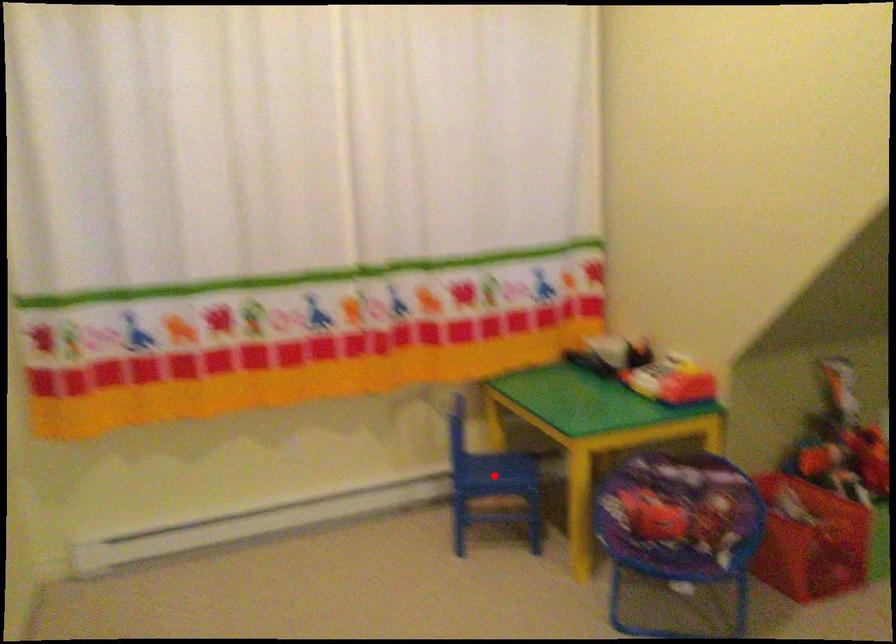
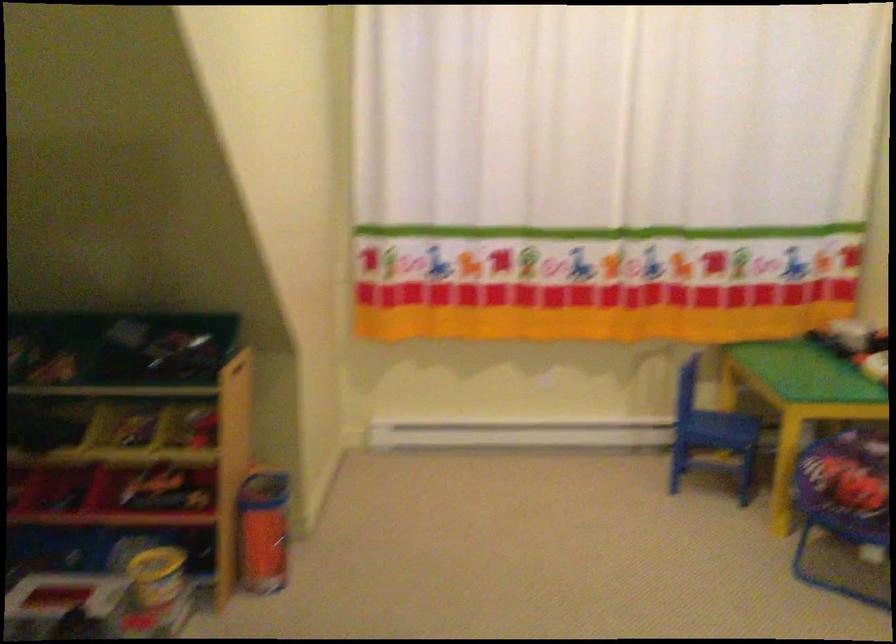
Find the pixel in the second image that matches the highlighted location in the first image.

(718, 430)